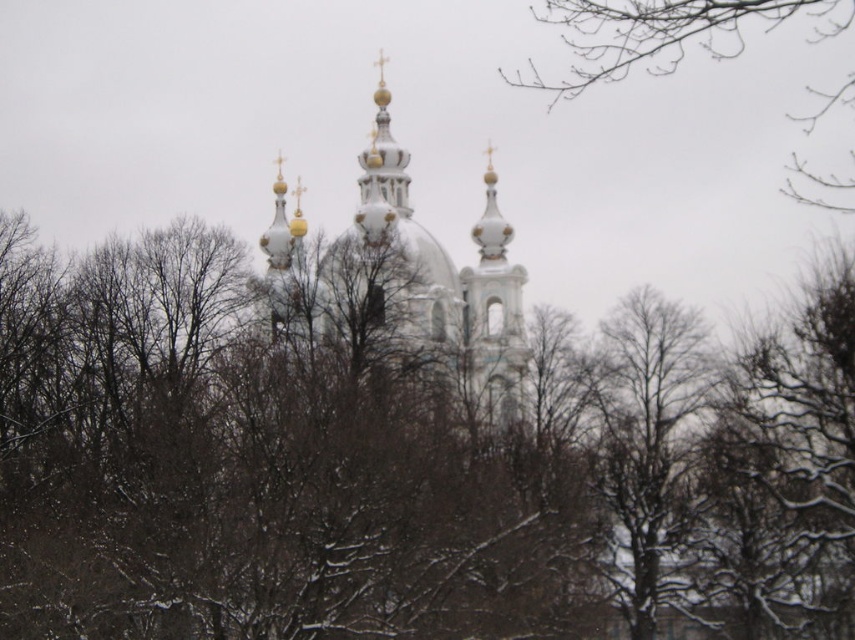
Question: Which of the following is the farthest from the observer?

Choices:
 (A) (781, 10)
 (B) (431, 273)
 (C) (703, 413)

Answer: (A)

Question: Considering the real-world distances, which object is farthest from the brown textured tree at center?

Choices:
 (A) white marble church at center
 (B) bare branches at upper right

Answer: (B)

Question: Can you confirm if brown textured tree at center is positioned to the right of white marble church at center?

Choices:
 (A) no
 (B) yes

Answer: (B)

Question: Is brown textured tree at center further to the viewer compared to bare branches at upper right?

Choices:
 (A) yes
 (B) no

Answer: (B)

Question: Is brown textured tree at center to the left of white marble church at center from the viewer's perspective?

Choices:
 (A) yes
 (B) no

Answer: (B)

Question: Estimate the real-world distances between objects in this image. Which object is closer to the brown textured tree at center?

Choices:
 (A) white marble church at center
 (B) bare branches at upper right

Answer: (A)